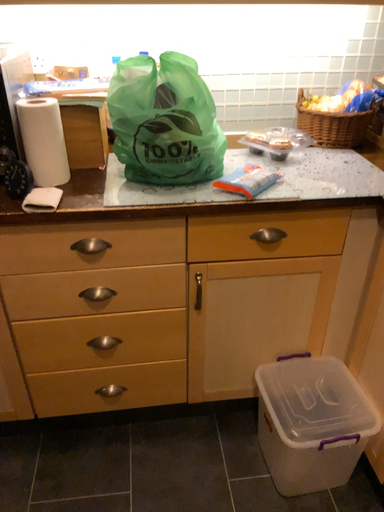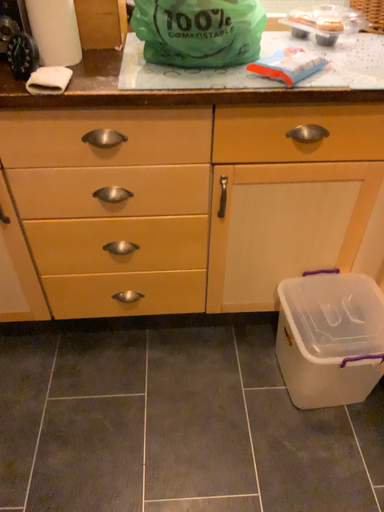
Question: How did the camera likely rotate when shooting the video?

Choices:
 (A) rotated downward
 (B) rotated upward

Answer: (A)